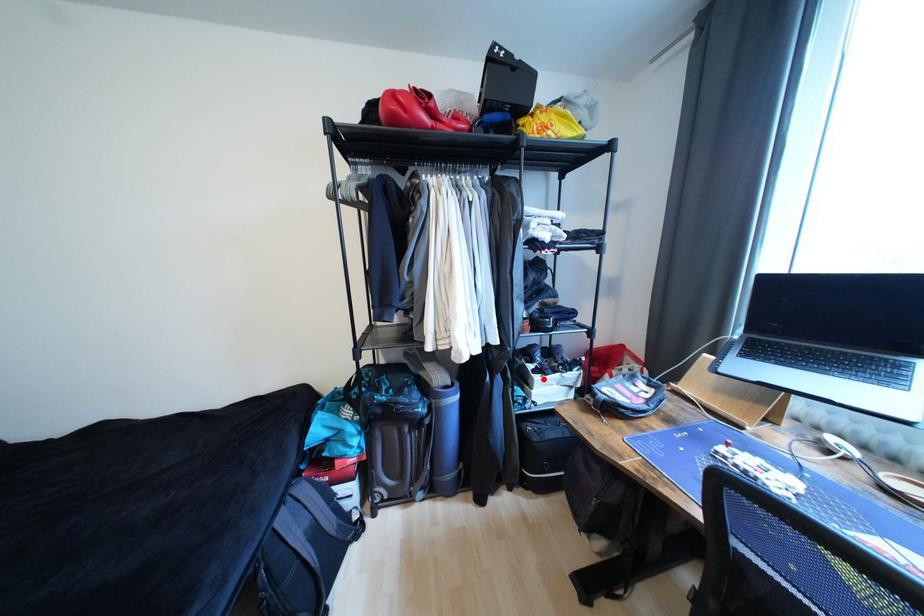
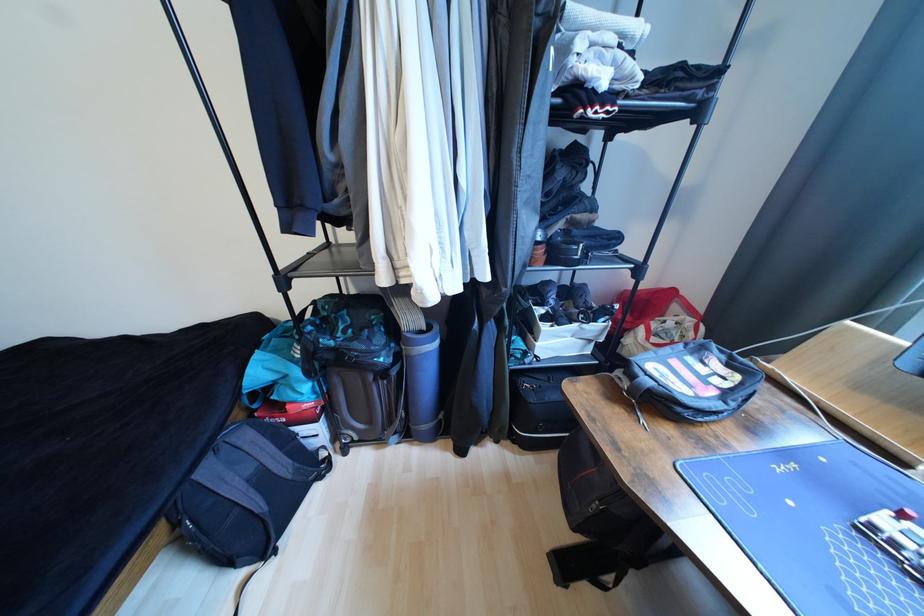
Locate, in the second image, the point that corresponds to the highlighted location in the first image.

(552, 329)